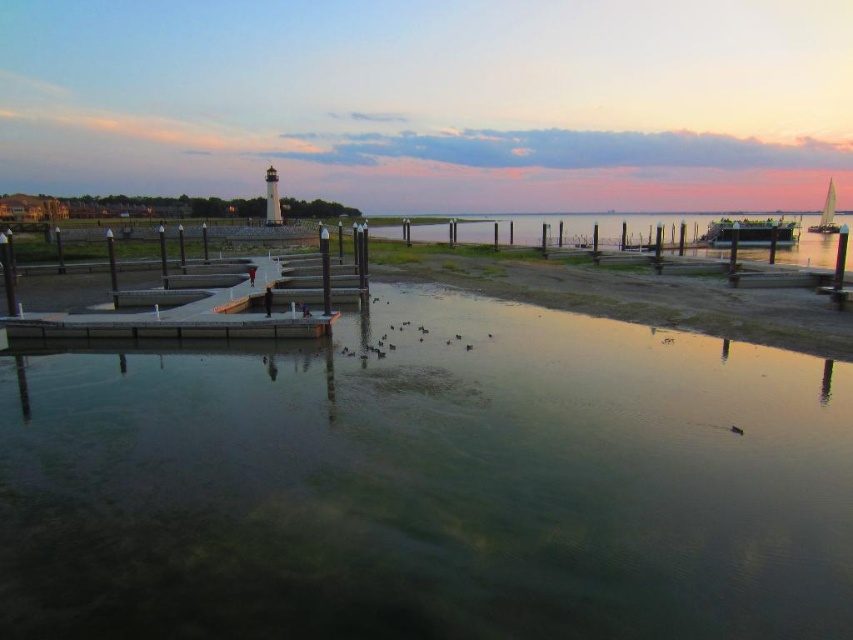
Question: Is smooth concrete dock at center positioned behind metallic silver boat at center right?

Choices:
 (A) no
 (B) yes

Answer: (A)

Question: Is smooth concrete dock at center further to camera compared to white sailboat at right?

Choices:
 (A) no
 (B) yes

Answer: (A)

Question: Which point is closer to the camera?

Choices:
 (A) (207, 298)
 (B) (817, 227)
 (C) (788, 221)
 (D) (691, 636)

Answer: (D)

Question: Which point is farther to the camera?

Choices:
 (A) (193, 548)
 (B) (828, 230)
 (C) (178, 269)
 (D) (782, 221)

Answer: (B)

Question: Is smooth concrete dock at center to the left of white sailboat at right from the viewer's perspective?

Choices:
 (A) yes
 (B) no

Answer: (A)

Question: Which of the following is the closest to the observer?

Choices:
 (A) (109, 230)
 (B) (38, 426)
 (C) (764, 240)
 (D) (820, 228)

Answer: (B)